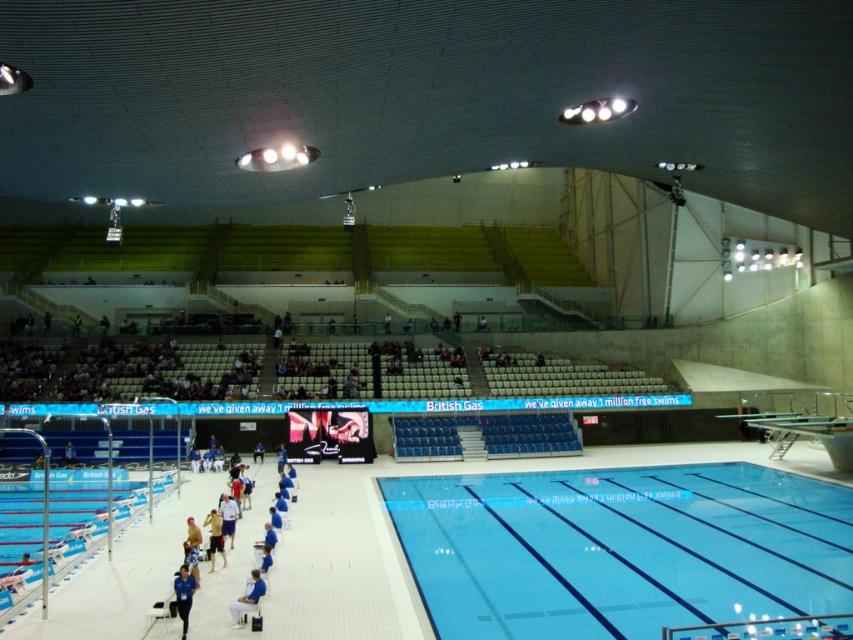
Question: Considering the relative positions of clear blue water at center and light blue fabric shirt at center in the image provided, where is clear blue water at center located with respect to light blue fabric shirt at center?

Choices:
 (A) right
 (B) left

Answer: (A)

Question: Where is clear blue water at center located in relation to light blue fabric shirt at center in the image?

Choices:
 (A) above
 (B) below

Answer: (B)

Question: Which is farther from the light blue fabric shorts at center?

Choices:
 (A) blue fabric shirt at lower center
 (B) blue fabric chair at lower center

Answer: (A)

Question: Which point appears farthest from the camera in this image?

Choices:
 (A) (180, 582)
 (B) (531, 476)
 (C) (248, 598)
 (D) (225, 522)

Answer: (B)

Question: Which point is farther to the camera?

Choices:
 (A) light blue fabric shirt at center
 (B) clear blue water at center
 (C) light blue fabric shorts at center

Answer: (A)

Question: Observing the image, what is the correct spatial positioning of clear blue water at center in reference to light blue fabric shirt at center?

Choices:
 (A) left
 (B) right

Answer: (B)